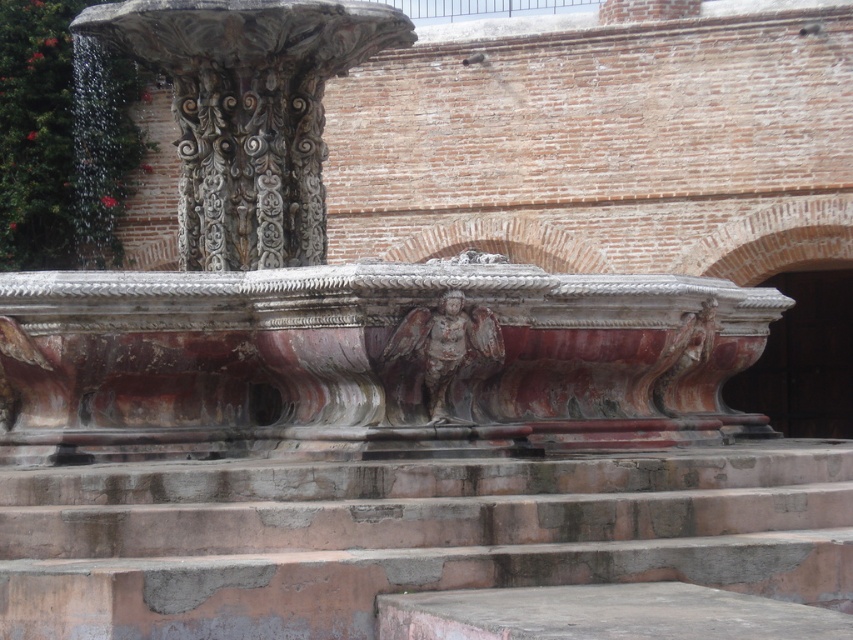
Question: Which of the following is the farthest from the observer?

Choices:
 (A) (548, 548)
 (B) (402, 417)
 (C) (195, 93)

Answer: (C)

Question: Estimate the real-world distances between objects in this image. Which object is closer to the marble fountain at center?

Choices:
 (A) rustic stone angel at center
 (B) carved stone column at upper left

Answer: (B)

Question: Is carved stone column at upper left wider than rustic stone angel at center?

Choices:
 (A) yes
 (B) no

Answer: (A)

Question: Is marble fountain at center positioned behind carved stone column at upper left?

Choices:
 (A) no
 (B) yes

Answer: (A)

Question: Is rustic stone stairs at center bigger than carved stone column at upper left?

Choices:
 (A) no
 (B) yes

Answer: (B)

Question: Among these points, which one is nearest to the camera?

Choices:
 (A) (659, 563)
 (B) (253, 198)
 (C) (471, 333)
 (D) (196, 166)

Answer: (A)